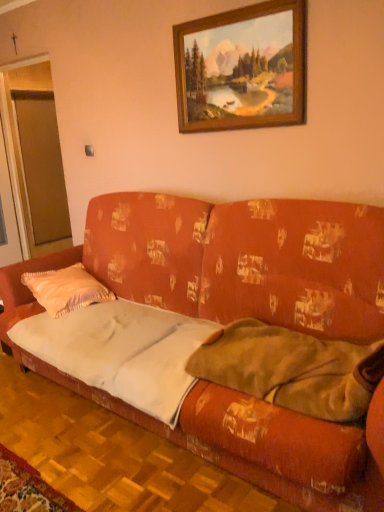
Question: Is the depth of soft green blanket at right less than that of transparent glass door at left?

Choices:
 (A) no
 (B) yes

Answer: (B)

Question: From a real-world perspective, is soft green blanket at right on top of transparent glass door at left?

Choices:
 (A) yes
 (B) no

Answer: (B)

Question: From the image's perspective, is soft green blanket at right under transparent glass door at left?

Choices:
 (A) yes
 (B) no

Answer: (A)

Question: Is soft green blanket at right at the right side of transparent glass door at left?

Choices:
 (A) no
 (B) yes

Answer: (B)

Question: From the image's perspective, does soft green blanket at right appear higher than transparent glass door at left?

Choices:
 (A) yes
 (B) no

Answer: (B)

Question: Does point (29, 98) appear closer or farther from the camera than point (72, 309)?

Choices:
 (A) closer
 (B) farther

Answer: (B)

Question: Considering the positions of transparent glass door at left and satin peach pillow at left in the image, is transparent glass door at left wider or thinner than satin peach pillow at left?

Choices:
 (A) thin
 (B) wide

Answer: (A)

Question: From a real-world perspective, is transparent glass door at left positioned above or below satin peach pillow at left?

Choices:
 (A) below
 (B) above

Answer: (B)

Question: Considering their positions, is transparent glass door at left located in front of or behind satin peach pillow at left?

Choices:
 (A) front
 (B) behind

Answer: (B)

Question: Is satin peach pillow at left bigger or smaller than transparent glass door at left?

Choices:
 (A) big
 (B) small

Answer: (B)

Question: From a real-world perspective, is satin peach pillow at left physically located above or below transparent glass door at left?

Choices:
 (A) below
 (B) above

Answer: (A)

Question: Considering their positions, is satin peach pillow at left located in front of or behind transparent glass door at left?

Choices:
 (A) behind
 (B) front

Answer: (B)

Question: Is point (56, 285) positioned closer to the camera than point (33, 174)?

Choices:
 (A) closer
 (B) farther

Answer: (A)

Question: From the image's perspective, is velvet orange couch at center located above or below satin peach pillow at left?

Choices:
 (A) above
 (B) below

Answer: (B)

Question: Does point (327, 239) appear closer or farther from the camera than point (54, 272)?

Choices:
 (A) closer
 (B) farther

Answer: (A)